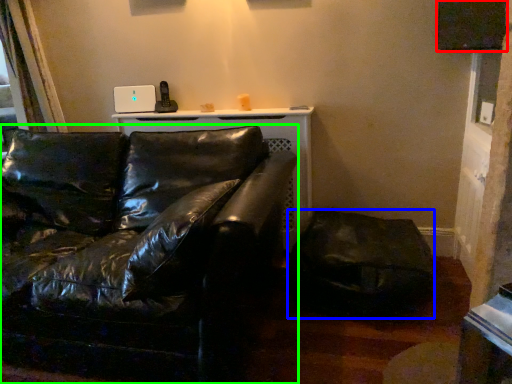
Question: Considering the real-world distances, which object is closest to window screen (highlighted by a red box)? swivel chair (highlighted by a blue box) or studio couch (highlighted by a green box).

Choices:
 (A) swivel chair
 (B) studio couch

Answer: (A)